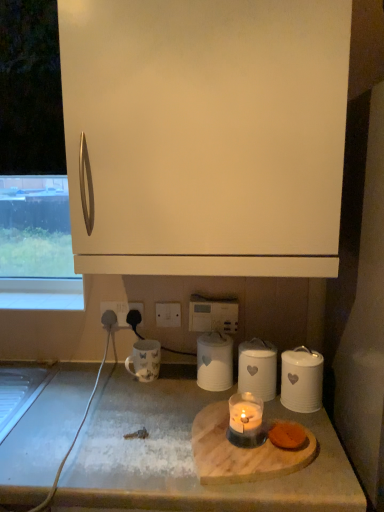
At what (x,y) coordinates should I click in order to perform the action: click on free space to the right of translucent glass candle at center. Please return your answer as a coordinate pair (x, y). The height and width of the screenshot is (512, 384). Looking at the image, I should click on (320, 448).